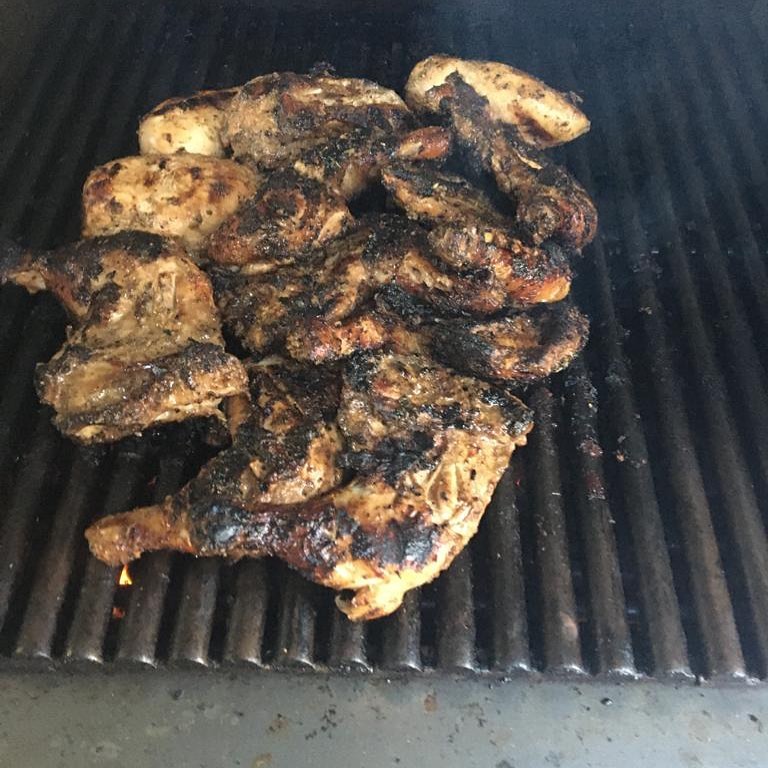
This screenshot has width=768, height=768. Identify the location of light areas. (502, 103), (177, 144).